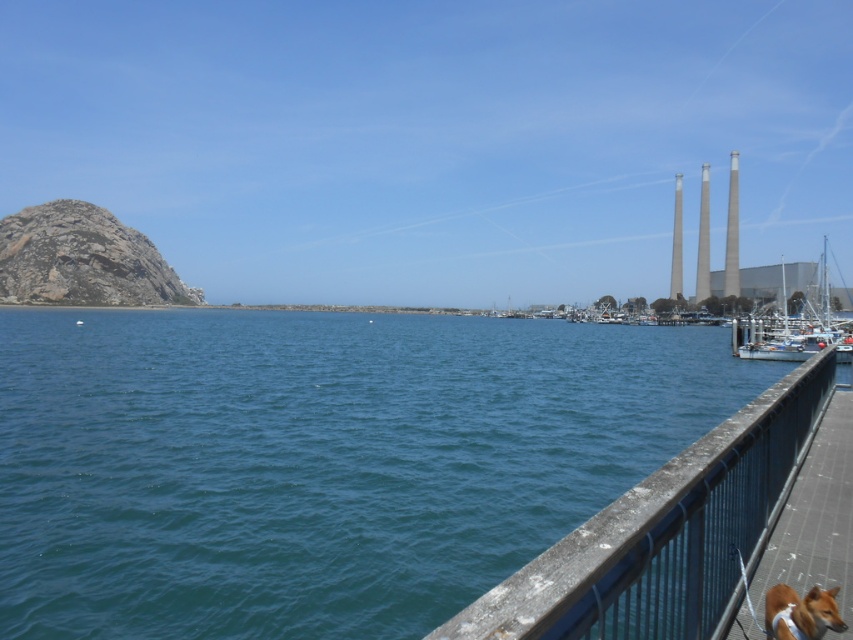
Based on the photo, which is above, blue water at center or white glossy boat at right?

white glossy boat at right is higher up.

Does blue water at center appear under white glossy boat at right?

Correct, blue water at center is located below white glossy boat at right.

The width and height of the screenshot is (853, 640). I want to click on blue water at center, so click(317, 442).

Is white glossy boat at right below brown fur dog at lower right?

No, white glossy boat at right is not below brown fur dog at lower right.

Describe the element at coordinates (790, 324) in the screenshot. The width and height of the screenshot is (853, 640). I see `white glossy boat at right` at that location.

Identify the location of white glossy boat at right. (790, 324).

Between point (788, 376) and point (769, 600), which one is positioned in front?

Point (769, 600) is in front.

Which is below, rusty metal railing at lower right or brown fur dog at lower right?

rusty metal railing at lower right

Is point (693, 470) positioned before point (786, 625)?

That is True.

Where is `rusty metal railing at lower right`? rusty metal railing at lower right is located at coordinates (666, 534).